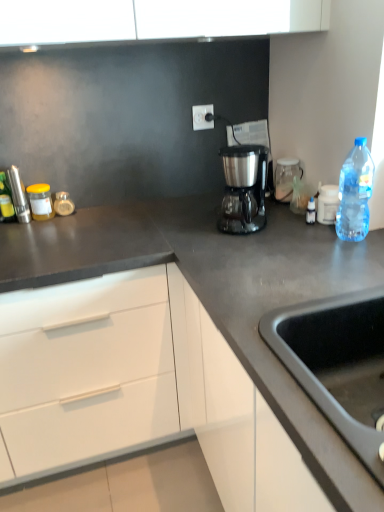
Locate an element on the screen. vacant space to the right of brushed metal pepper mill at left, acting as the first appliance starting from the back is located at coordinates (67, 222).